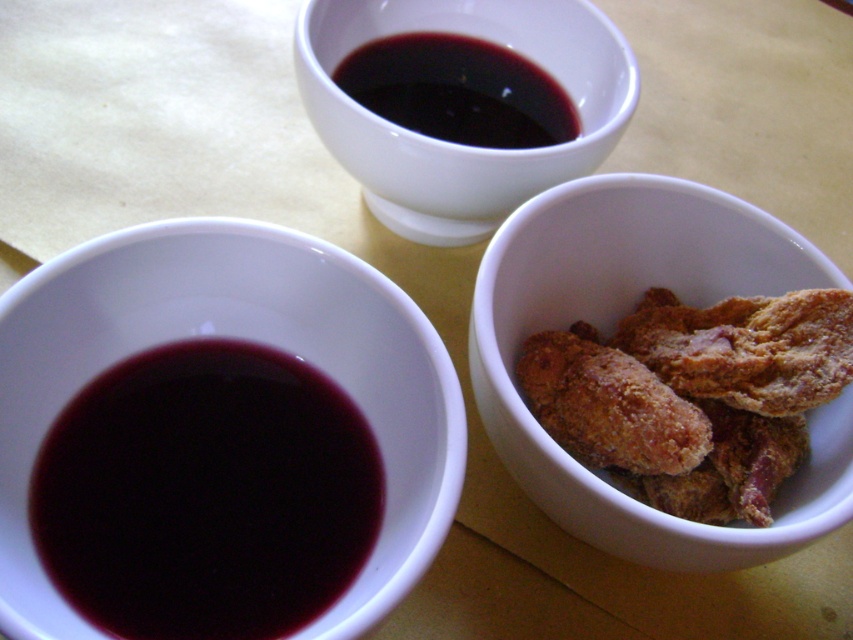
Which is more to the left, golden-brown fried snack at center-right or matte white bowl at upper center?

Positioned to the left is matte white bowl at upper center.

Does golden-brown fried snack at center-right lie in front of matte white bowl at upper center?

That is True.

Locate an element on the screen. golden-brown fried snack at center-right is located at coordinates (610, 330).

The height and width of the screenshot is (640, 853). I want to click on golden-brown fried snack at center-right, so [610, 330].

Does golden-brown fried snack at center-right appear on the right side of dark glossy sauce at upper center?

Indeed, golden-brown fried snack at center-right is positioned on the right side of dark glossy sauce at upper center.

Describe the element at coordinates (610, 330) in the screenshot. Image resolution: width=853 pixels, height=640 pixels. I see `golden-brown fried snack at center-right` at that location.

Identify the location of golden-brown fried snack at center-right. The width and height of the screenshot is (853, 640). (610, 330).

Can you confirm if dark red matte bowl at left is positioned to the left of dark glossy sauce at upper center?

Correct, you'll find dark red matte bowl at left to the left of dark glossy sauce at upper center.

The height and width of the screenshot is (640, 853). What do you see at coordinates (271, 342) in the screenshot?
I see `dark red matte bowl at left` at bounding box center [271, 342].

Who is more forward, (x=93, y=259) or (x=438, y=86)?

Point (x=93, y=259) is more forward.

Locate an element on the screen. dark red matte bowl at left is located at coordinates (271, 342).